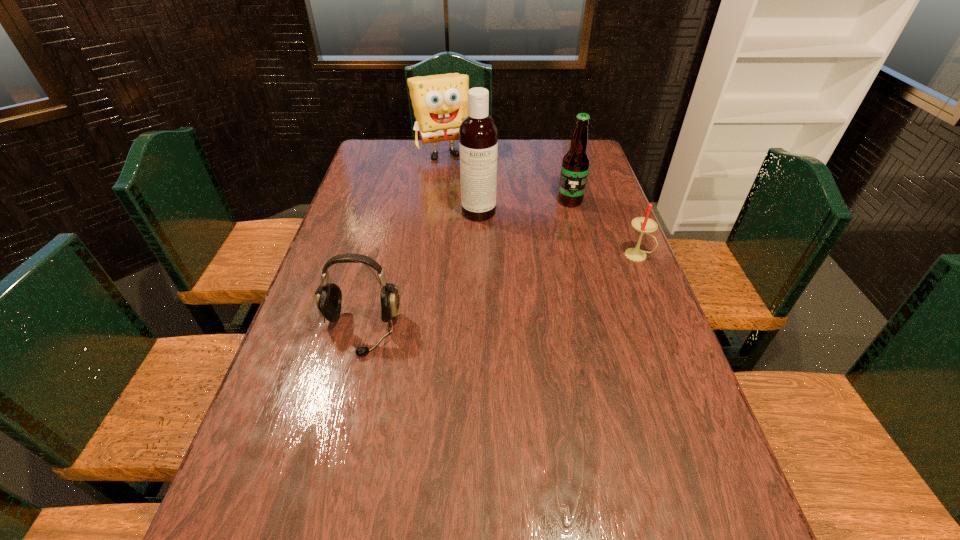
Find the location of a particular element. This screenshot has height=540, width=960. blank region between the beer bottle and the sponge is located at coordinates (506, 177).

What are the coordinates of `free area in between the headset and the beer bottle` in the screenshot? It's located at (466, 266).

In order to click on free spot between the tallest object and the beer bottle in this screenshot , I will do `click(524, 206)`.

The image size is (960, 540). Find the location of `free space between the farthest object and the beer bottle`. free space between the farthest object and the beer bottle is located at coordinates (x=506, y=177).

Image resolution: width=960 pixels, height=540 pixels. Identify the location of free space that is in between the headset and the beer bottle. (466, 266).

I want to click on free space between the rightmost object and the tallest object, so click(558, 234).

Find the location of a particular element. free spot between the nearest object and the sponge is located at coordinates click(x=401, y=242).

The width and height of the screenshot is (960, 540). I want to click on vacant region between the dishwasher detergent and the second nearest object, so click(x=558, y=234).

Locate an element on the screen. Image resolution: width=960 pixels, height=540 pixels. object that is the closest to the beer bottle is located at coordinates point(478,133).

Identify which object is the second nearest to the second nearest object. Please provide its 2D coordinates. Your answer should be formatted as a tuple, i.e. [(x, y)], where the tuple contains the x and y coordinates of a point satisfying the conditions above.

[(478, 133)]